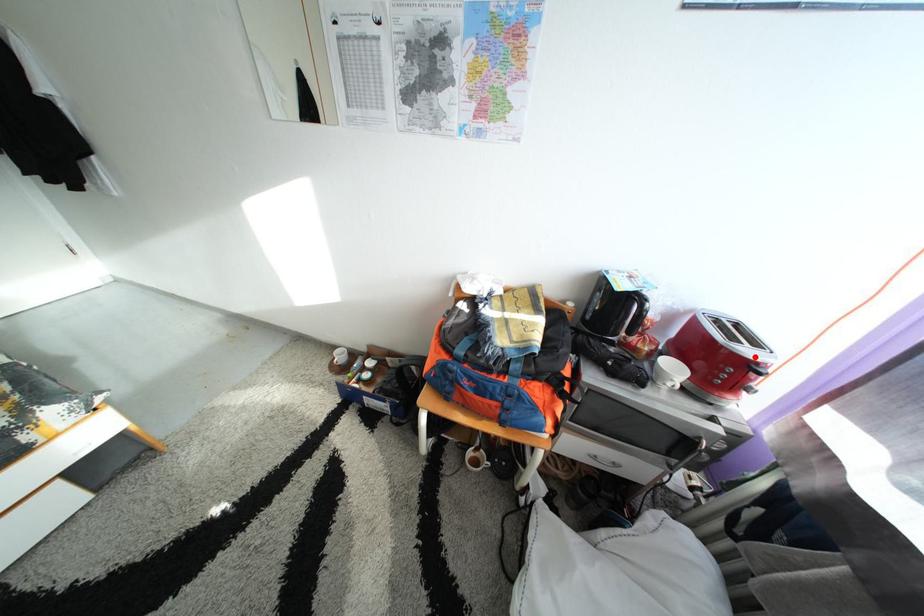
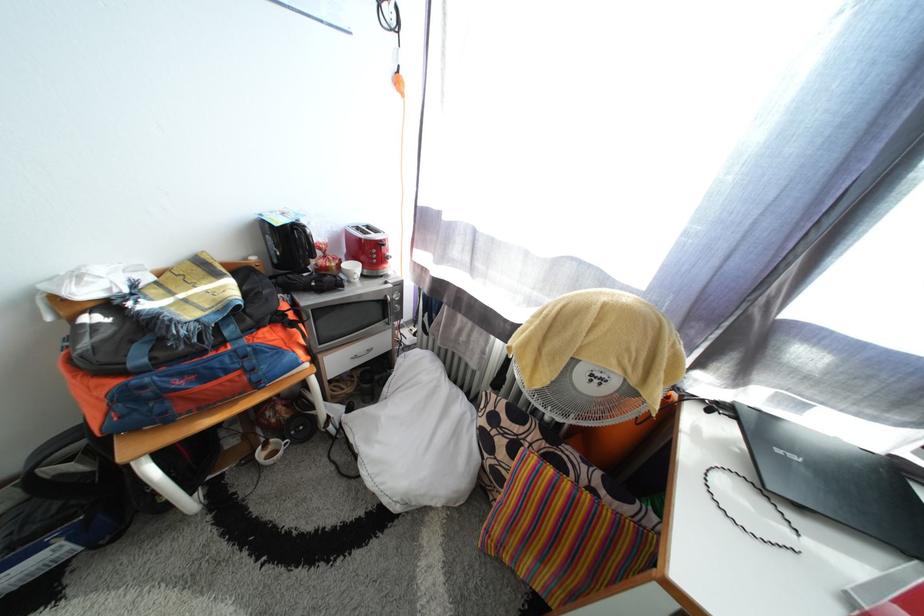
Locate, in the second image, the point that corresponds to the highlighted location in the first image.

(383, 243)